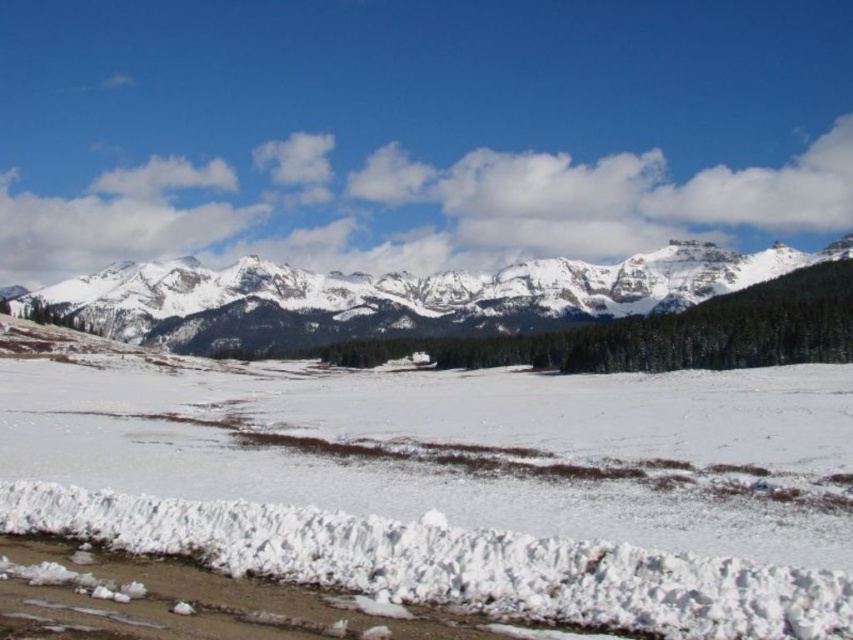
You are standing at the snow barrier edge in the foreground of the winter scene. You see two points marked in the image. Which point, point (115, 513) or point (187, 280), is closer to you?

Point (115, 513) is closer to you than point (187, 280).

You are standing at the point marked as point (463, 484) in the winter landscape. What terrain are you currently standing on?

You are standing on white snow at center.